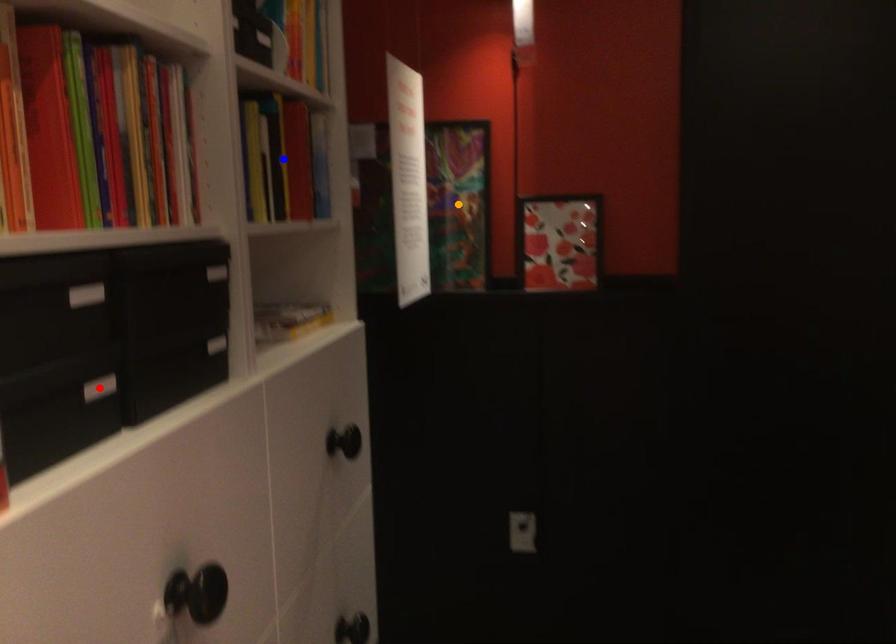
Order these from nearest to farthest:
blue point | orange point | red point

red point, blue point, orange point